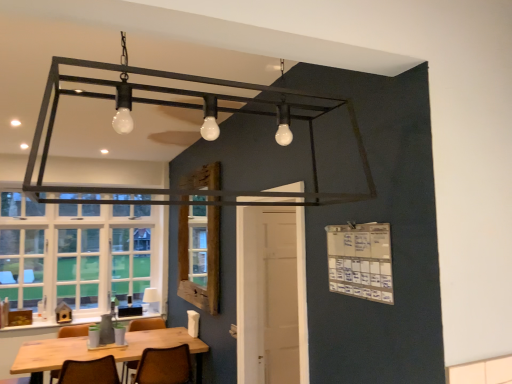
Question: Considering the relative positions of wooden table at lower left and brown leather chair at lower center, which is counted as the first chair, starting from the right, in the image provided, is wooden table at lower left to the left of brown leather chair at lower center, which is counted as the first chair, starting from the right, from the viewer's perspective?

Choices:
 (A) no
 (B) yes

Answer: (B)

Question: Is brown leather chair at lower center, the third chair viewed from the left, at the back of wooden table at lower left?

Choices:
 (A) yes
 (B) no

Answer: (B)

Question: From the image's perspective, is wooden table at lower left beneath brown leather chair at lower center, which is counted as the first chair, starting from the right?

Choices:
 (A) no
 (B) yes

Answer: (B)

Question: Considering the relative sizes of wooden table at lower left and brown leather chair at lower center, the third chair viewed from the left, in the image provided, is wooden table at lower left shorter than brown leather chair at lower center, the third chair viewed from the left,?

Choices:
 (A) no
 (B) yes

Answer: (A)

Question: Is brown leather chair at lower center, the third chair viewed from the left, a part of wooden table at lower left?

Choices:
 (A) no
 (B) yes

Answer: (B)

Question: Is point (8, 299) positioned closer to the camera than point (39, 377)?

Choices:
 (A) closer
 (B) farther

Answer: (B)

Question: Choose the correct answer: Is white glass window at left inside wooden table at lower left or outside it?

Choices:
 (A) outside
 (B) inside

Answer: (A)

Question: Visually, is white glass window at left positioned to the left or to the right of wooden table at lower left?

Choices:
 (A) left
 (B) right

Answer: (A)

Question: From a real-world perspective, is white glass window at left above or below wooden table at lower left?

Choices:
 (A) below
 (B) above

Answer: (B)

Question: Is wooden frame at center inside or outside of wooden table at lower left?

Choices:
 (A) inside
 (B) outside

Answer: (B)

Question: In the image, is wooden frame at center positioned in front of or behind wooden table at lower left?

Choices:
 (A) front
 (B) behind

Answer: (B)

Question: From their relative heights in the image, would you say wooden frame at center is taller or shorter than wooden table at lower left?

Choices:
 (A) short
 (B) tall

Answer: (B)

Question: Considering the relative positions of wooden frame at center and wooden table at lower left in the image provided, is wooden frame at center to the left or to the right of wooden table at lower left?

Choices:
 (A) right
 (B) left

Answer: (A)

Question: From the image's perspective, is brown leather chair at lower center, which is counted as the first chair, starting from the right, above or below wooden frame at center?

Choices:
 (A) below
 (B) above

Answer: (A)

Question: Does point (181, 375) appear closer or farther from the camera than point (197, 292)?

Choices:
 (A) closer
 (B) farther

Answer: (A)